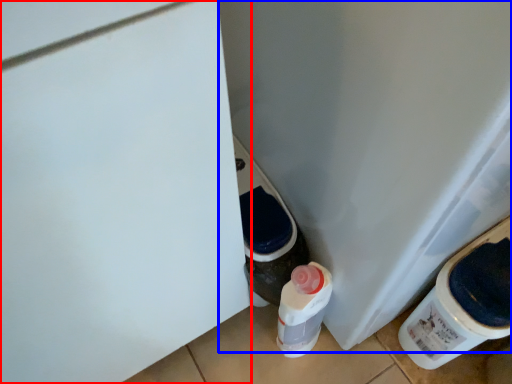
Question: Which point is further to the camera, door (highlighted by a red box) or water cooler (highlighted by a blue box)?

Choices:
 (A) door
 (B) water cooler

Answer: (B)